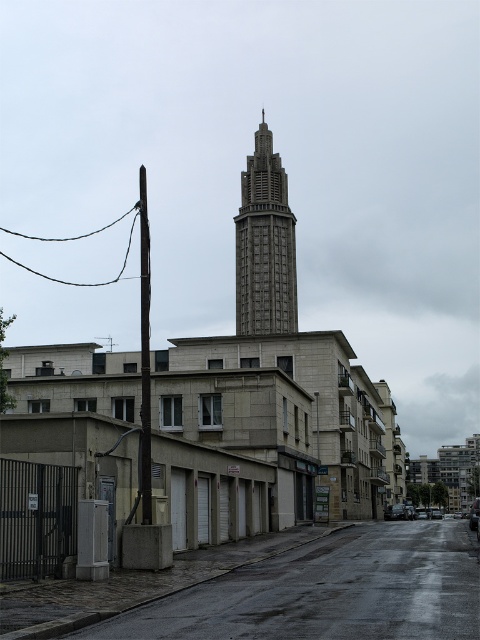
Between concrete wall at lower left and gray concrete tower at center, which one appears on the left side from the viewer's perspective?

Positioned to the left is gray concrete tower at center.

Identify the location of concrete wall at lower left. (328, 593).